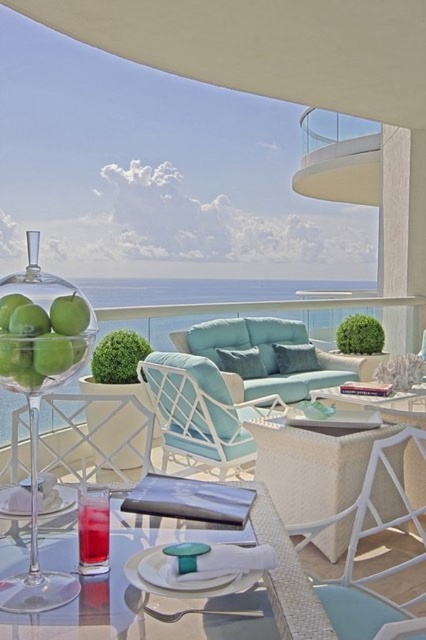
Image resolution: width=426 pixels, height=640 pixels. Describe the element at coordinates (270, 355) in the screenshot. I see `teal fabric couch at center` at that location.

Is teal fabric couch at center positioned at the back of clear glass table at center?

Yes, teal fabric couch at center is behind clear glass table at center.

Who is more distant from viewer, (193, 337) or (293, 604)?

The point (193, 337) is more distant.

In order to click on teal fabric couch at center in this screenshot , I will do `click(270, 355)`.

Does point (34, 244) come behind point (189, 448)?

That is False.

Is point (72, 323) closer to viewer compared to point (184, 456)?

Yes, point (72, 323) is closer to viewer.

The height and width of the screenshot is (640, 426). I want to click on transparent glass bowl at center, so click(40, 392).

Is teal fabric couch at center positioned in front of white glass railing at upper right?

Yes, teal fabric couch at center is closer to the viewer.

Is point (227, 353) behind point (325, 168)?

That is False.

At what (x,y) coordinates should I click in order to perform the action: click on teal fabric couch at center. Please return your answer as a coordinate pair (x, y). Looking at the image, I should click on (270, 355).